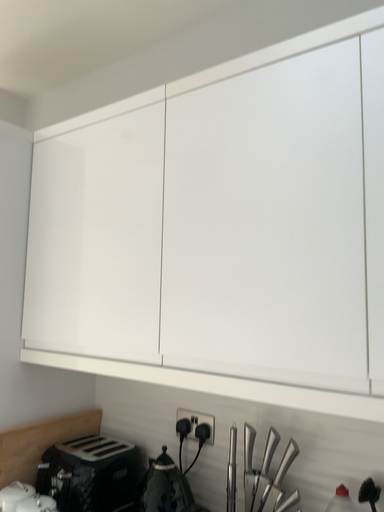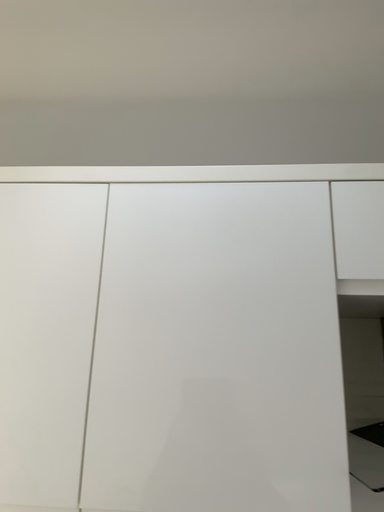
Question: Which way did the camera rotate in the video?

Choices:
 (A) rotated upward
 (B) rotated downward

Answer: (A)